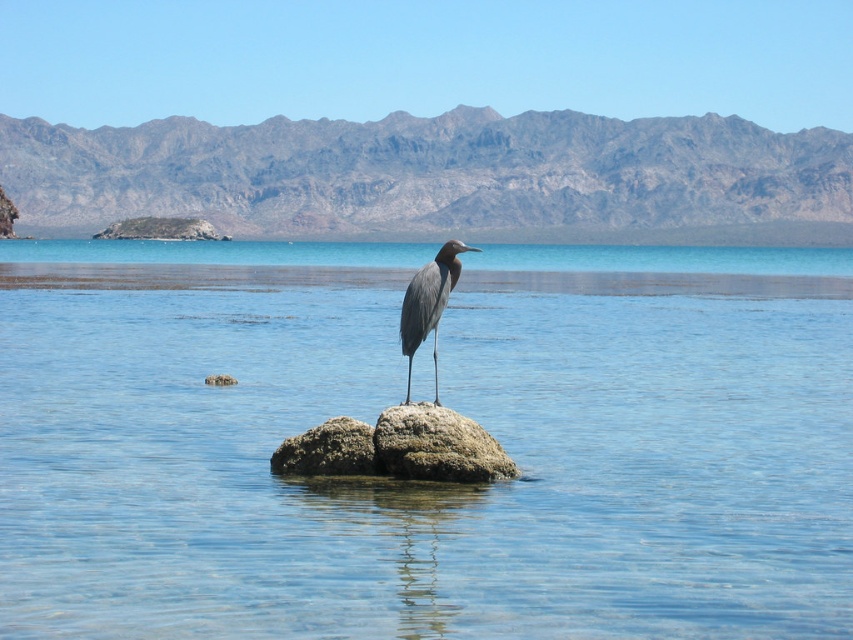
Based on the photo, can you confirm if rusty concrete rock at center is positioned below gray matte bird at center?

Indeed, rusty concrete rock at center is positioned under gray matte bird at center.

Can you confirm if rusty concrete rock at center is smaller than gray matte bird at center?

Yes.

Which is in front, point (323, 442) or point (428, 308)?

Positioned in front is point (428, 308).

The width and height of the screenshot is (853, 640). What are the coordinates of `rusty concrete rock at center` in the screenshot? It's located at (328, 451).

Is rusty rock at center to the right of rusty concrete rock at center from the viewer's perspective?

Correct, you'll find rusty rock at center to the right of rusty concrete rock at center.

Locate an element on the screen. The image size is (853, 640). rusty rock at center is located at coordinates (437, 445).

Does point (437, 436) lie in front of point (375, 460)?

That is True.

Where is `rusty rock at center`? rusty rock at center is located at coordinates (437, 445).

Does gray rocky mountains at upper center have a larger size compared to rusty concrete rock at center?

Yes, gray rocky mountains at upper center is bigger than rusty concrete rock at center.

Is point (270, 141) more distant than point (351, 440)?

Yes, point (270, 141) is behind point (351, 440).

Between point (309, 186) and point (316, 460), which one is positioned in front?

Positioned in front is point (316, 460).

In order to click on gray rocky mountains at upper center in this screenshot , I will do `click(437, 177)`.